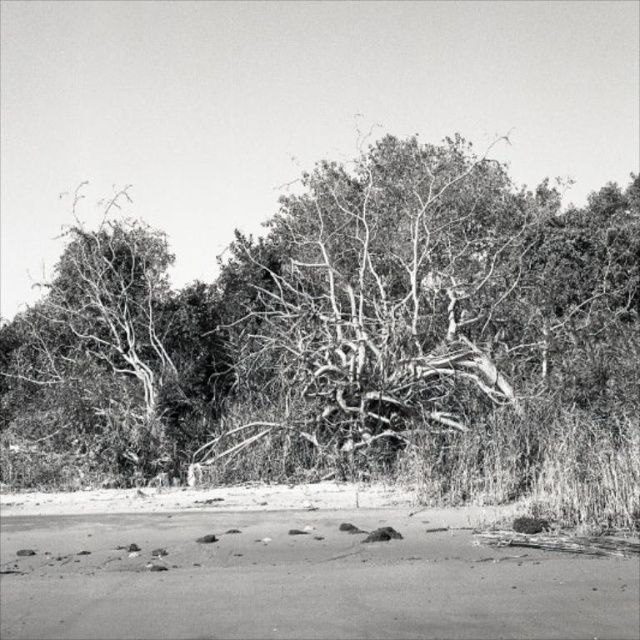
Question: Does grainy bark tree at center have a greater width compared to smooth sand at lower center?

Choices:
 (A) no
 (B) yes

Answer: (B)

Question: Does grainy bark tree at center appear on the right side of smooth sand at lower center?

Choices:
 (A) yes
 (B) no

Answer: (B)

Question: Which point appears farthest from the camera in this image?

Choices:
 (A) (417, 196)
 (B) (353, 605)

Answer: (A)

Question: Among these objects, which one is farthest from the camera?

Choices:
 (A) grainy bark tree at center
 (B) smooth sand at lower center

Answer: (A)

Question: Does grainy bark tree at center have a larger size compared to smooth sand at lower center?

Choices:
 (A) no
 (B) yes

Answer: (B)

Question: Which of the following is the closest to the observer?

Choices:
 (A) (378, 248)
 (B) (177, 627)

Answer: (B)